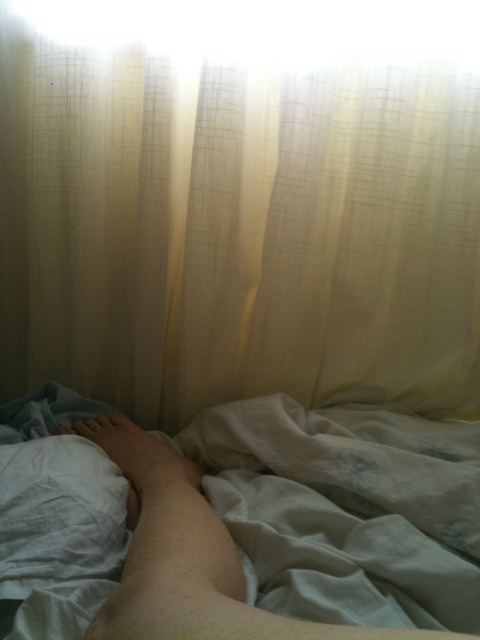
Question: Can you confirm if white sheer curtain at upper center is smaller than skinny white leg at lower left?

Choices:
 (A) yes
 (B) no

Answer: (B)

Question: Which point is closer to the camera?

Choices:
 (A) white sheer curtain at upper center
 (B) skinny white leg at lower left

Answer: (B)

Question: From the image, what is the correct spatial relationship of white sheer curtain at upper center in relation to skinny white leg at lower left?

Choices:
 (A) above
 (B) below

Answer: (A)

Question: Does white sheer curtain at upper center have a greater width compared to skinny white leg at lower left?

Choices:
 (A) yes
 (B) no

Answer: (A)

Question: Which point is closer to the camera taking this photo?

Choices:
 (A) (178, 538)
 (B) (61, 289)

Answer: (A)

Question: Which point is closer to the camera taking this photo?

Choices:
 (A) (238, 268)
 (B) (96, 632)

Answer: (B)